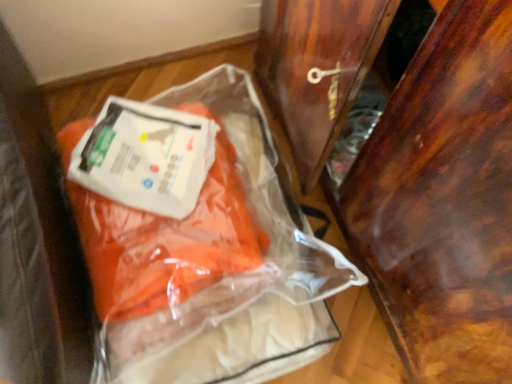
Question: Can you confirm if wooden wardrobe door at right is positioned to the left of transparent plastic bag at center?

Choices:
 (A) yes
 (B) no

Answer: (B)

Question: Can you confirm if wooden wardrobe door at right is taller than transparent plastic bag at center?

Choices:
 (A) yes
 (B) no

Answer: (A)

Question: Are wooden wardrobe door at right and transparent plastic bag at center located far from each other?

Choices:
 (A) yes
 (B) no

Answer: (B)

Question: Is wooden wardrobe door at right not within transparent plastic bag at center?

Choices:
 (A) no
 (B) yes

Answer: (B)

Question: Is wooden wardrobe door at right further to camera compared to transparent plastic bag at center?

Choices:
 (A) yes
 (B) no

Answer: (B)

Question: Can you see wooden wardrobe door at right touching transparent plastic bag at center?

Choices:
 (A) yes
 (B) no

Answer: (B)

Question: Is transparent plastic bag at center not inside wooden wardrobe door at right?

Choices:
 (A) yes
 (B) no

Answer: (A)

Question: From a real-world perspective, does transparent plastic bag at center stand above wooden wardrobe door at right?

Choices:
 (A) yes
 (B) no

Answer: (B)

Question: Does transparent plastic bag at center appear on the left side of wooden wardrobe door at right?

Choices:
 (A) no
 (B) yes

Answer: (B)

Question: Is transparent plastic bag at center facing towards wooden wardrobe door at right?

Choices:
 (A) no
 (B) yes

Answer: (A)

Question: Considering the relative sizes of transparent plastic bag at center and wooden wardrobe door at right in the image provided, is transparent plastic bag at center wider than wooden wardrobe door at right?

Choices:
 (A) no
 (B) yes

Answer: (A)

Question: Is transparent plastic bag at center oriented away from wooden wardrobe door at right?

Choices:
 (A) yes
 (B) no

Answer: (B)

Question: Is wooden wardrobe door at right wider or thinner than transparent plastic bag at center?

Choices:
 (A) thin
 (B) wide

Answer: (B)